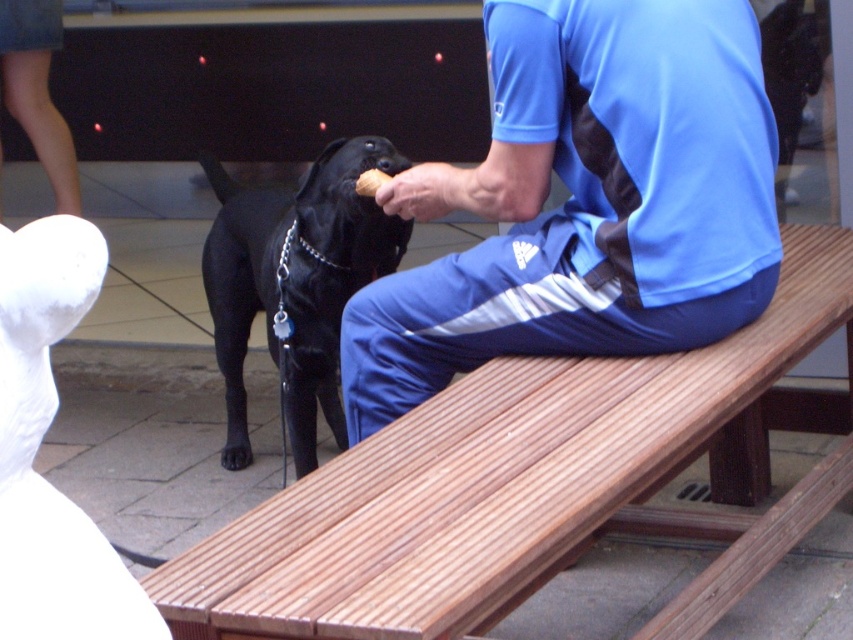
Question: Among these points, which one is farthest from the camera?

Choices:
 (A) (157, 593)
 (B) (279, 340)

Answer: (B)

Question: Can you confirm if blue fabric shirt at upper right is wider than black smooth dog at center?

Choices:
 (A) yes
 (B) no

Answer: (A)

Question: Does white fabric at upper left have a greater width compared to yellowish-brown crumbly at center?

Choices:
 (A) no
 (B) yes

Answer: (B)

Question: Which of the following is the closest to the observer?

Choices:
 (A) (347, 582)
 (B) (508, 232)
 (C) (399, 240)

Answer: (A)

Question: Does blue fabric shirt at upper right have a lesser width compared to yellowish-brown crumbly at center?

Choices:
 (A) yes
 (B) no

Answer: (B)

Question: Which of the following is the farthest from the observer?

Choices:
 (A) wooden bench at center
 (B) black smooth dog at center
 (C) white fabric at upper left
 (D) yellowish-brown crumbly at center

Answer: (C)